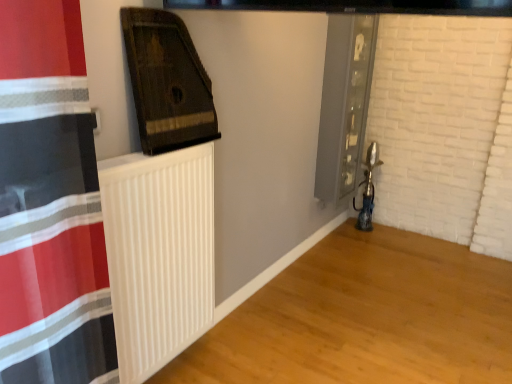
Question: Should I look upward or downward to see dark brown wood at upper left, which ranks as the second wood in right-to-left order?

Choices:
 (A) up
 (B) down

Answer: (A)

Question: Considering the relative sizes of dark brown wood at upper left, positioned as the first wood in left-to-right order, and white matte radiator at lower left, which ranks as the 2th wood in top-to-bottom order, in the image provided, is dark brown wood at upper left, positioned as the first wood in left-to-right order, thinner than white matte radiator at lower left, which ranks as the 2th wood in top-to-bottom order,?

Choices:
 (A) yes
 (B) no

Answer: (A)

Question: Can you confirm if dark brown wood at upper left, which ranks as the second wood in right-to-left order, is positioned to the right of white matte radiator at lower left, which ranks as the 2th wood in top-to-bottom order?

Choices:
 (A) yes
 (B) no

Answer: (B)

Question: Is dark brown wood at upper left, which ranks as the second wood in right-to-left order, closer to camera compared to white matte radiator at lower left, which ranks as the 2th wood in top-to-bottom order?

Choices:
 (A) yes
 (B) no

Answer: (B)

Question: Is dark brown wood at upper left, arranged as the 1th wood when viewed from the top, far from white matte radiator at lower left, which is counted as the second wood, starting from the left?

Choices:
 (A) yes
 (B) no

Answer: (A)

Question: Is dark brown wood at upper left, placed as the second wood when sorted from bottom to top, next to white matte radiator at lower left, which ranks as the 2th wood in top-to-bottom order?

Choices:
 (A) yes
 (B) no

Answer: (B)

Question: Does dark brown wood at upper left, placed as the second wood when sorted from bottom to top, have a larger size compared to white matte radiator at lower left, which ranks as the 2th wood in top-to-bottom order?

Choices:
 (A) yes
 (B) no

Answer: (B)

Question: Can you confirm if white matte radiator at lower left, which is counted as the second wood, starting from the left, is bigger than metallic glass screen door at right?

Choices:
 (A) yes
 (B) no

Answer: (A)

Question: Is the depth of white matte radiator at lower left, the 1th wood from the bottom, less than that of metallic glass screen door at right?

Choices:
 (A) yes
 (B) no

Answer: (A)

Question: Considering the relative sizes of white matte radiator at lower left, which is counted as the second wood, starting from the left, and metallic glass screen door at right in the image provided, is white matte radiator at lower left, which is counted as the second wood, starting from the left, thinner than metallic glass screen door at right?

Choices:
 (A) yes
 (B) no

Answer: (B)

Question: Can you confirm if white matte radiator at lower left, which ranks as the 1th wood in right-to-left order, is positioned to the left of metallic glass screen door at right?

Choices:
 (A) no
 (B) yes

Answer: (A)

Question: Does white matte radiator at lower left, which ranks as the 2th wood in top-to-bottom order, have a greater height compared to metallic glass screen door at right?

Choices:
 (A) yes
 (B) no

Answer: (B)

Question: Is white matte radiator at lower left, which ranks as the 2th wood in top-to-bottom order, shorter than metallic glass screen door at right?

Choices:
 (A) no
 (B) yes

Answer: (B)

Question: Are white ribbed radiator at center and white matte radiator at lower left, the 1th wood from the bottom, far apart?

Choices:
 (A) yes
 (B) no

Answer: (B)